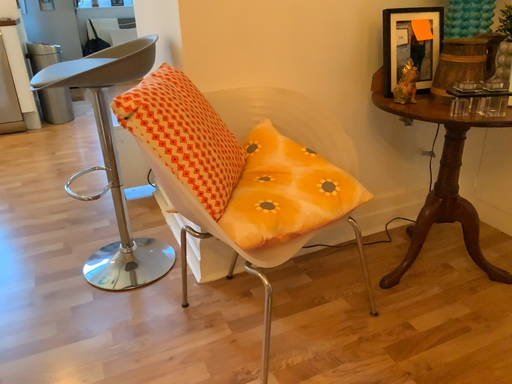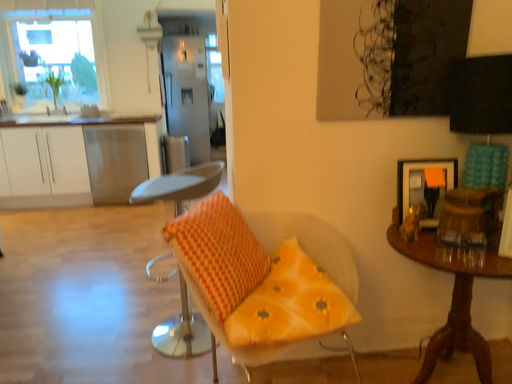
Question: Which way did the camera rotate in the video?

Choices:
 (A) rotated left
 (B) rotated right

Answer: (A)